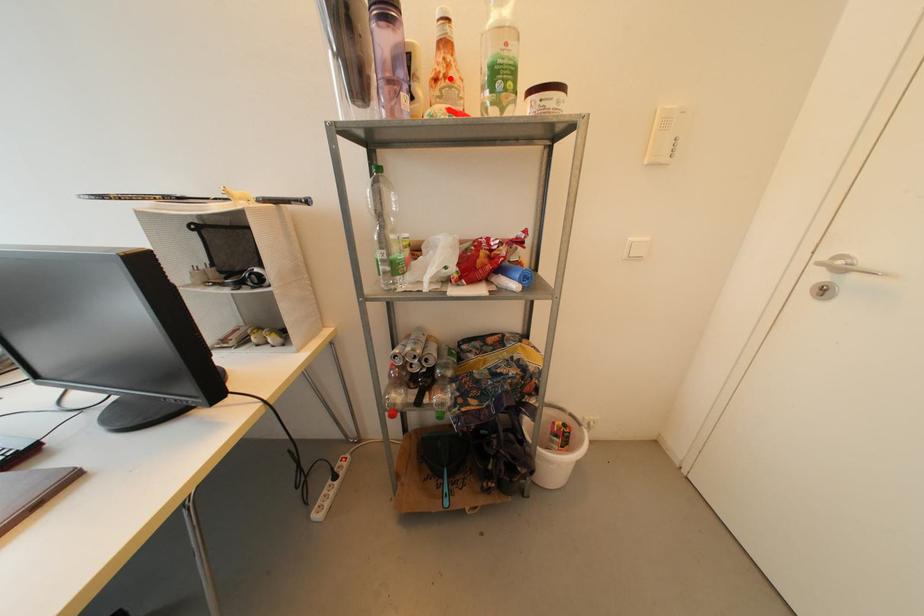
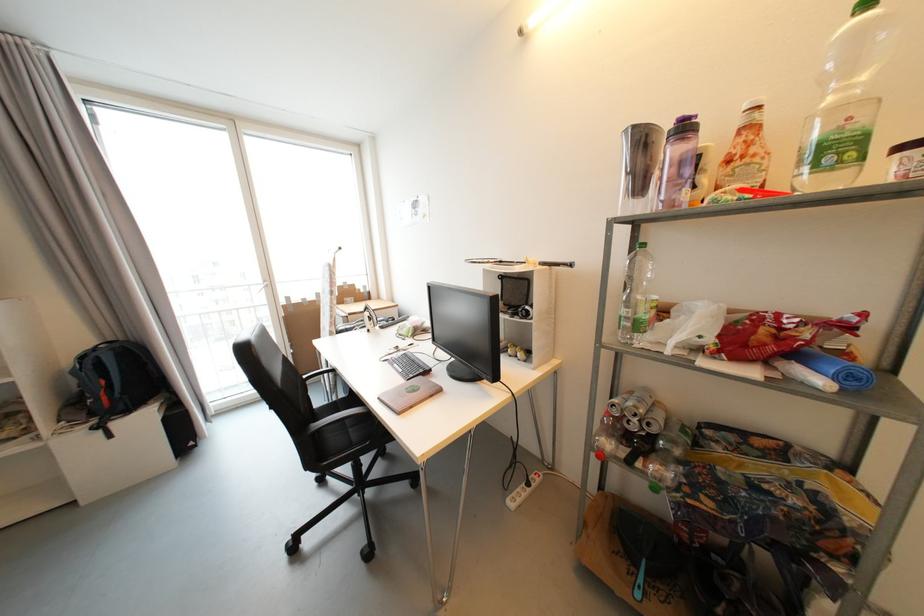
The point at the highlighted location is marked in the first image. Where is the corresponding point in the second image?

(748, 159)